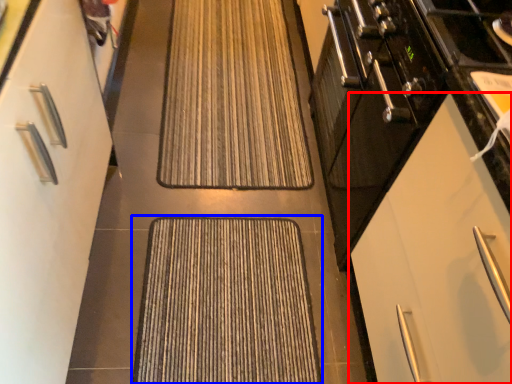
Question: Which point is closer to the camera, cabinetry (highlighted by a red box) or doormat (highlighted by a blue box)?

Choices:
 (A) cabinetry
 (B) doormat

Answer: (A)